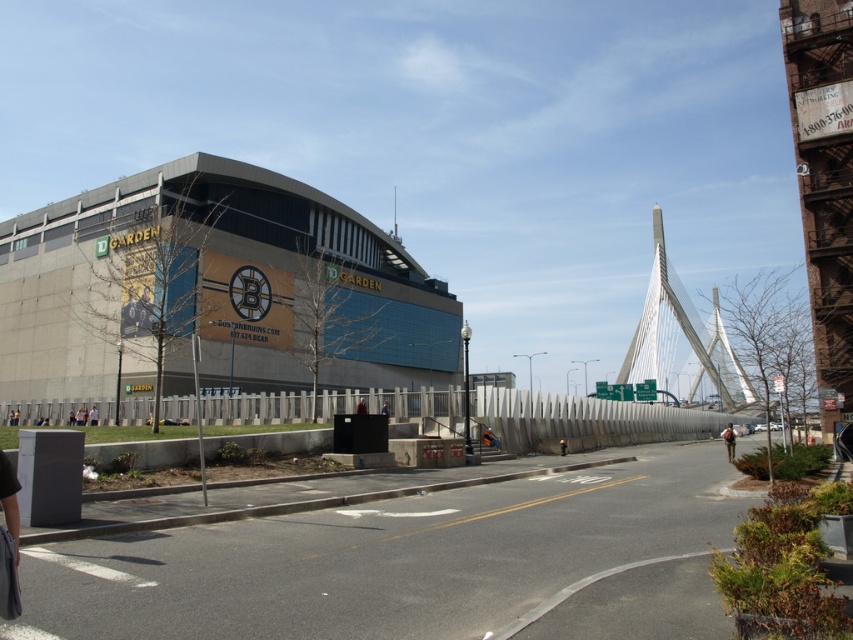
Who is shorter, brown leather jacket at center or blue fabric jacket at center?

With less height is blue fabric jacket at center.

Does brown leather jacket at center have a lesser width compared to blue fabric jacket at center?

In fact, brown leather jacket at center might be wider than blue fabric jacket at center.

Does point (727, 456) lie in front of point (380, 413)?

No.

Where is `brown leather jacket at center`? This screenshot has width=853, height=640. brown leather jacket at center is located at coordinates pyautogui.click(x=729, y=440).

Which of these two, orange fabric bag at center or white cotton shirt at center, stands taller?

With more height is orange fabric bag at center.

This screenshot has width=853, height=640. Describe the element at coordinates (490, 440) in the screenshot. I see `orange fabric bag at center` at that location.

Where is `orange fabric bag at center`? The width and height of the screenshot is (853, 640). orange fabric bag at center is located at coordinates (490, 440).

Can you confirm if brown leather jacket at center is bigger than yellow fabric person at center?

Correct, brown leather jacket at center is larger in size than yellow fabric person at center.

Is point (733, 449) closer to camera compared to point (560, 445)?

Yes, it is in front of point (560, 445).

Describe the element at coordinates (729, 440) in the screenshot. This screenshot has height=640, width=853. I see `brown leather jacket at center` at that location.

Locate an element on the screen. This screenshot has height=640, width=853. brown leather jacket at center is located at coordinates (729, 440).